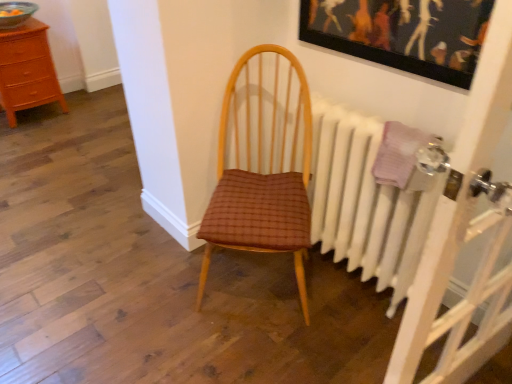
Image resolution: width=512 pixels, height=384 pixels. In order to click on free area in between brown woven fabric chair at center and white painted radiator at right in this screenshot , I will do `click(339, 311)`.